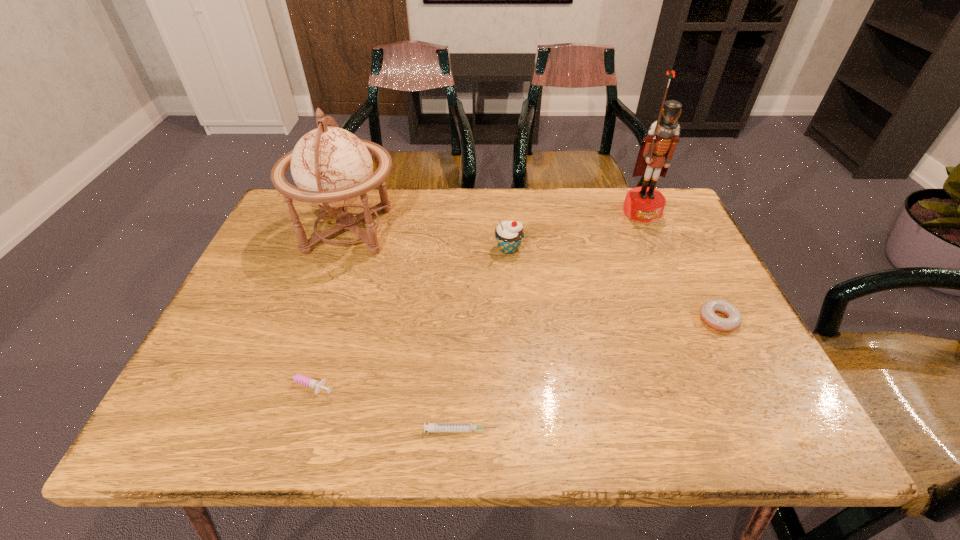
You are a GUI agent. You are given a task and a screenshot of the screen. Output one action in this format:
    pyautogui.click(x=<x>, y=<y>)
    Task: Click on the vacant area at the far right corner
    The height and width of the screenshot is (540, 960).
    Given the screenshot: What is the action you would take?
    pyautogui.click(x=621, y=202)

Locate an element on the screen. vacant space at the near right corner of the desktop is located at coordinates (714, 418).

The image size is (960, 540). Find the location of `blank region between the cupcake and the nutcracker`. blank region between the cupcake and the nutcracker is located at coordinates (575, 230).

The height and width of the screenshot is (540, 960). Find the location of `vacant space that's between the nutcracker and the third shortest object`. vacant space that's between the nutcracker and the third shortest object is located at coordinates (681, 265).

Locate an element on the screen. Image resolution: width=960 pixels, height=540 pixels. vacant space that is in between the fifth farthest object and the fourth farthest object is located at coordinates (511, 352).

Identify the location of empty space that is in between the nutcracker and the nearest object. (551, 321).

The width and height of the screenshot is (960, 540). In order to click on free spot between the globe and the nutcracker in this screenshot , I will do `click(495, 221)`.

This screenshot has height=540, width=960. I want to click on empty location between the third object from left to right and the cupcake, so click(x=485, y=340).

This screenshot has width=960, height=540. Identify the location of empty space that is in between the nearer syringe and the nutcracker. (551, 321).

Image resolution: width=960 pixels, height=540 pixels. Identify the location of free space between the second tallest object and the cupcake. 429,240.